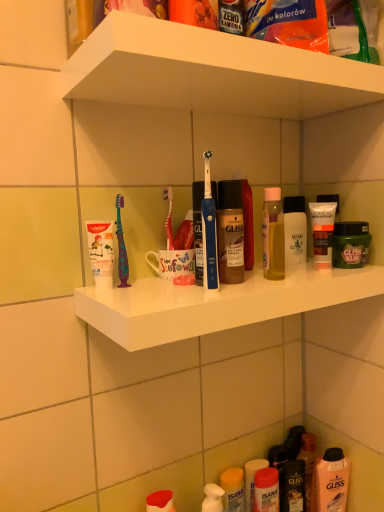
I want to click on spots to the right of blue plastic toothbrush at center, so tap(281, 284).